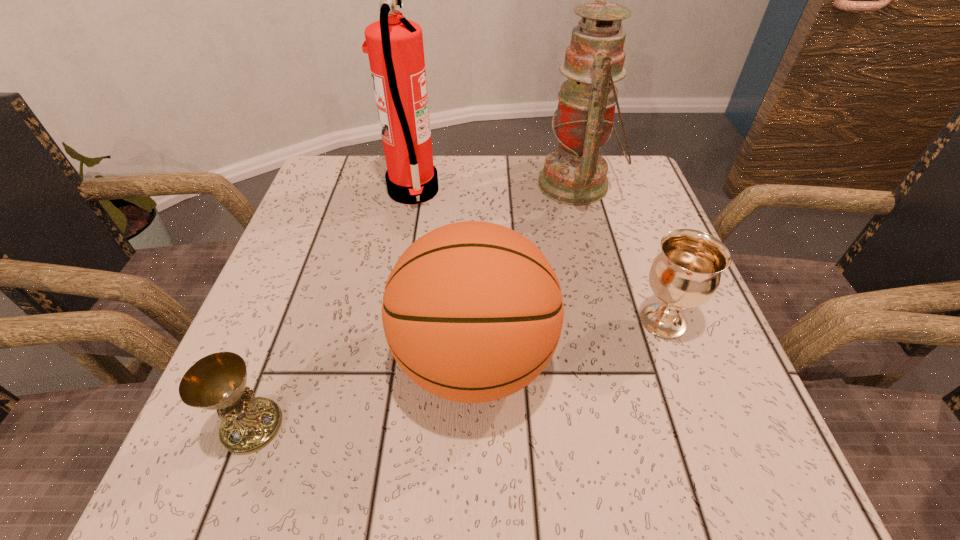
I want to click on free spot between the shorter chalice and the fire extinguisher, so click(332, 308).

The height and width of the screenshot is (540, 960). I want to click on free point between the third tallest object and the taller chalice, so click(x=568, y=341).

I want to click on free space between the third shortest object and the left chalice, so click(x=363, y=393).

Image resolution: width=960 pixels, height=540 pixels. I want to click on object that ranks as the closest to the second tallest object, so click(x=394, y=45).

The image size is (960, 540). I want to click on object that ranks as the third closest to the farther chalice, so click(394, 45).

In order to click on free space that satisfies the following two spatial constraints: 1. on the back side of the shortest object; 2. on the right side of the basketball in this screenshot , I will do `click(276, 361)`.

Where is `vacant area that satisfies the following two spatial constraints: 1. on the front side of the oil lamp; 2. with the nozzle aimed from the fire extinguisher`? vacant area that satisfies the following two spatial constraints: 1. on the front side of the oil lamp; 2. with the nozzle aimed from the fire extinguisher is located at coordinates (579, 191).

At what (x,y) coordinates should I click in order to perform the action: click on blank space that satisfies the following two spatial constraints: 1. with the nozzle aimed from the farther chalice; 2. on the left side of the fire extinguisher. Please return your answer as a coordinate pair (x, y). Image resolution: width=960 pixels, height=540 pixels. Looking at the image, I should click on (390, 321).

Where is `free space that satisfies the following two spatial constraints: 1. on the back side of the farther chalice; 2. with the nozzle aimed from the fire extinguisher`? free space that satisfies the following two spatial constraints: 1. on the back side of the farther chalice; 2. with the nozzle aimed from the fire extinguisher is located at coordinates (615, 191).

The height and width of the screenshot is (540, 960). I want to click on vacant position in the image that satisfies the following two spatial constraints: 1. with the nozzle aimed from the fire extinguisher; 2. on the left side of the farther chalice, so click(x=390, y=321).